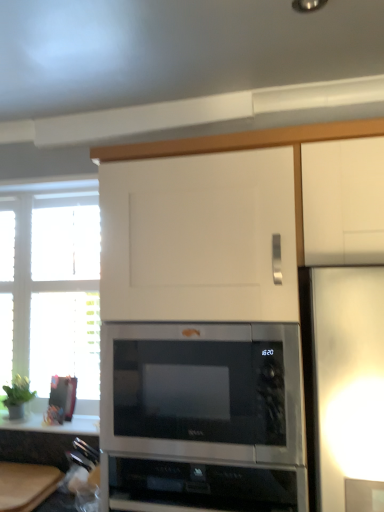
The image size is (384, 512). What are the coordinates of `empty space that is ontop of wooden cutting board at lower left (from a real-world perspective)` in the screenshot? It's located at (24, 480).